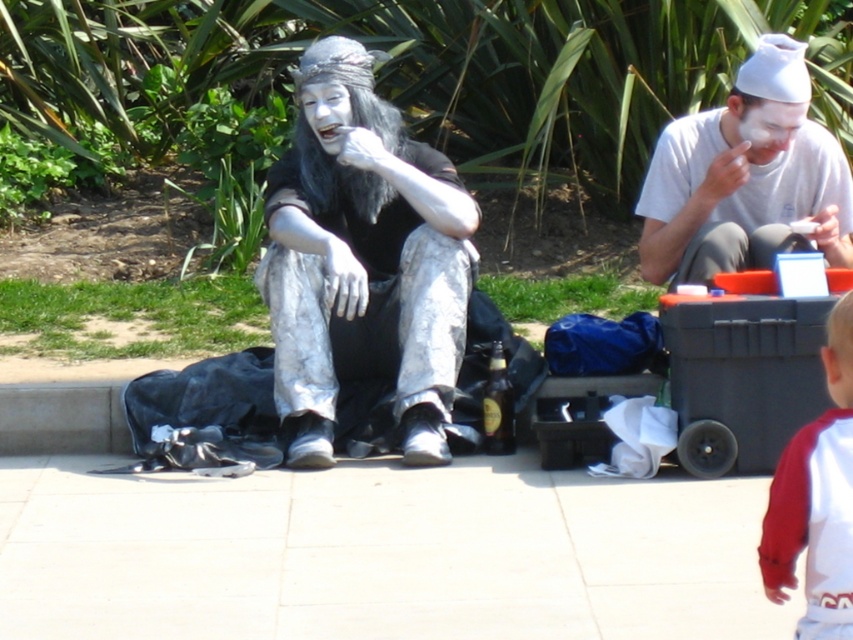
Between point (639, 250) and point (834, 330), which one is positioned behind?

The point (639, 250) is behind.

Between white matte face paint at center and red jersey at lower right, which one is positioned lower?

red jersey at lower right is lower down.

Who is more forward, (694,243) or (828,612)?

Positioned in front is point (828,612).

Identify the location of white matte face paint at center. (x=746, y=177).

Measure the distance from silver metallic face paint at center to white matte face paint at center.

silver metallic face paint at center is 1.10 meters from white matte face paint at center.

The image size is (853, 640). Identify the location of silver metallic face paint at center. (363, 260).

Image resolution: width=853 pixels, height=640 pixels. What do you see at coordinates (363, 260) in the screenshot?
I see `silver metallic face paint at center` at bounding box center [363, 260].

What are the coordinates of `silver metallic face paint at center` in the screenshot? It's located at (363, 260).

Between silver metallic face paint at center and red jersey at lower right, which one appears on the right side from the viewer's perspective?

red jersey at lower right is more to the right.

Who is taller, silver metallic face paint at center or red jersey at lower right?

With more height is silver metallic face paint at center.

Who is more forward, (383, 317) or (820, 499)?

Positioned in front is point (820, 499).

Where is `silver metallic face paint at center`? The height and width of the screenshot is (640, 853). silver metallic face paint at center is located at coordinates (363, 260).